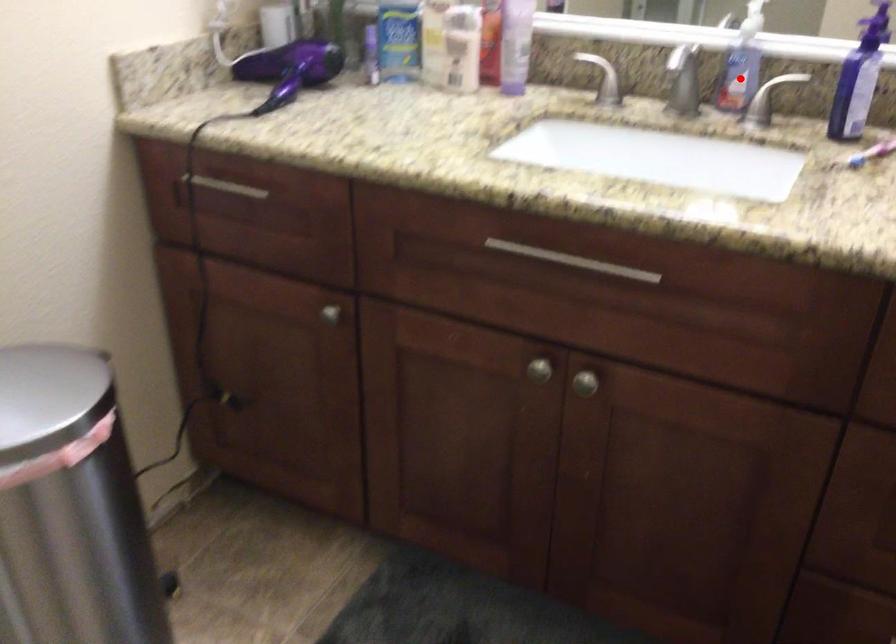
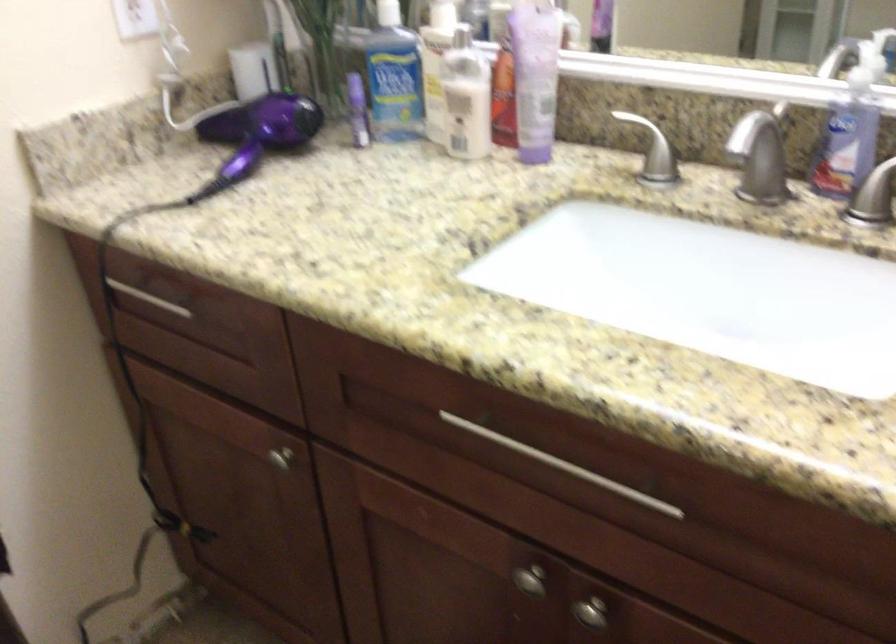
Question: I am providing you with two images of the same scene from different viewpoints. A red point is shown in image1. For the corresponding object point in image2, is it positioned nearer or farther from the camera?

Choices:
 (A) Nearer
 (B) Farther

Answer: (A)